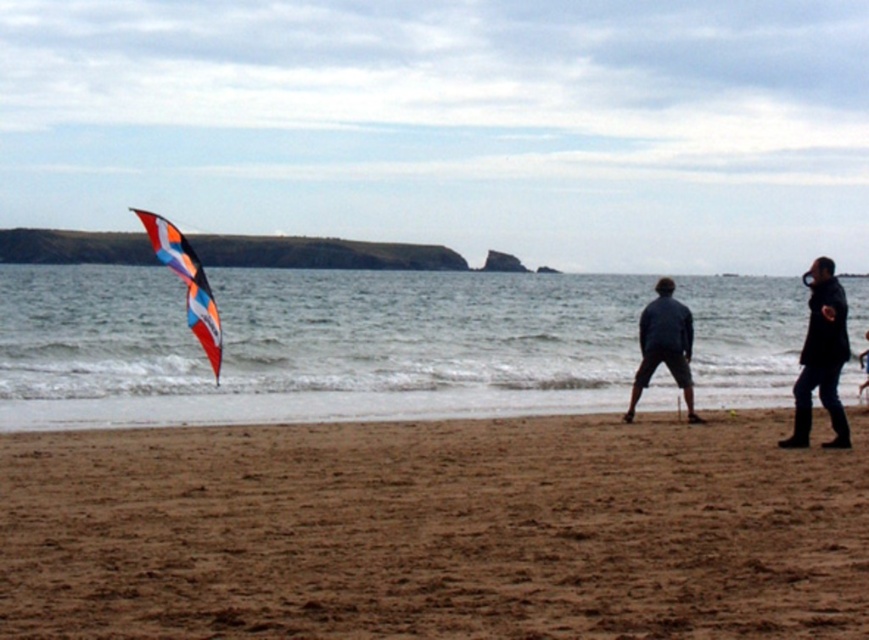
Question: Can you confirm if dark blue denim shorts at center is positioned below multicolored fabric kite at left?

Choices:
 (A) yes
 (B) no

Answer: (A)

Question: Can you confirm if black leather jacket at right is positioned to the right of dark blue denim shorts at center?

Choices:
 (A) no
 (B) yes

Answer: (B)

Question: Among these points, which one is nearest to the camera?

Choices:
 (A) (425, 609)
 (B) (196, 316)

Answer: (A)

Question: Which of the following is the farthest from the observer?

Choices:
 (A) (203, 291)
 (B) (680, 468)
 (C) (322, 385)
 (D) (668, 321)

Answer: (C)

Question: Which of the following is the farthest from the observer?

Choices:
 (A) dark blue denim shorts at center
 (B) black leather jacket at right

Answer: (A)

Question: Is brown sandy beach at lower center to the right of translucent kite at center from the viewer's perspective?

Choices:
 (A) no
 (B) yes

Answer: (B)